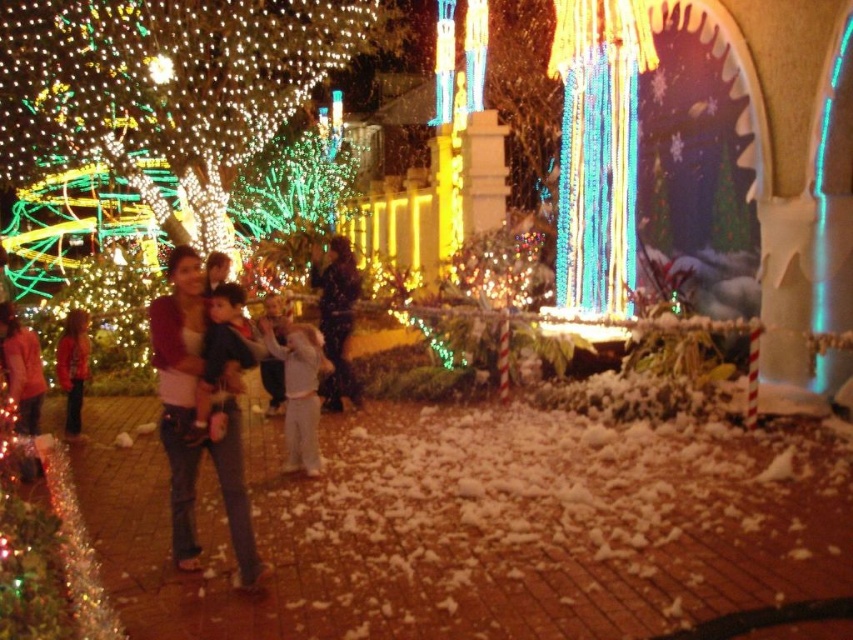
You are a fashion designer observing the festive outdoor scene. You notice the white cotton pants at center and the red cotton sweater at left. Which clothing item is taller in the image?

The white cotton pants at center is taller than the red cotton sweater at left.

You are standing at the point marked by the coordinates point (194, 417) in the image. What object is located directly in front of you?

The point (194, 417) corresponds to denim jeans at center, so the object directly in front of you is the denim jeans at center.